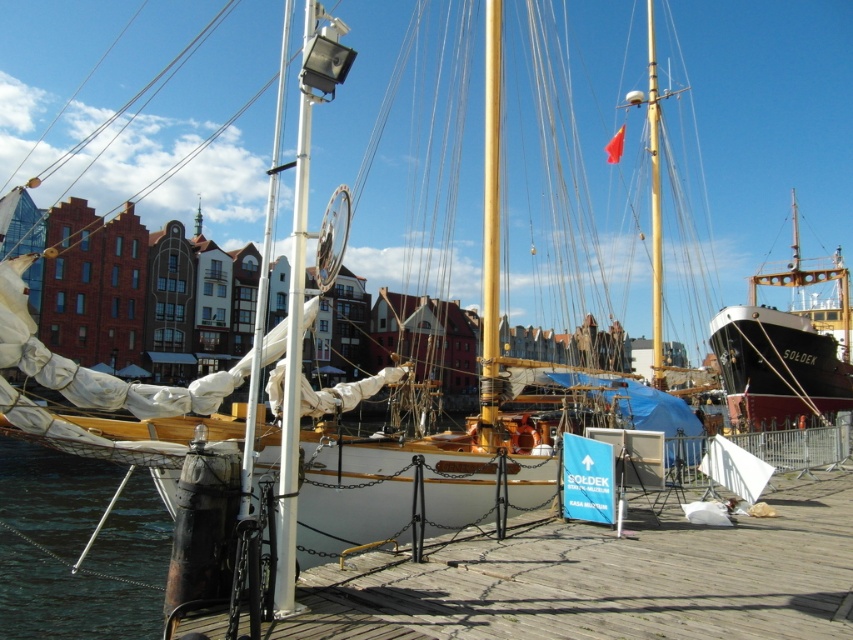
You are a harbor guide and need to direct a visitor to the SOLDEK boat. The visitor is currently standing near the black polished wood ship at right and wants to know how to reach the SOLDEK boat. Which direction should they go relative to the yellow polished wood mast at center?

The black polished wood ship at right is smaller than the yellow polished wood mast at center, so the visitor should head towards the yellow polished wood mast at center to find the SOLDEK boat.

You are a sailor planning to board the black polished wood ship at right from the yellow polished wood mast at center. Considering their heights, will you need to climb down or climb up to reach the ship?

The black polished wood ship at right has a lesser height compared to the yellow polished wood mast at center, so you will need to climb down to reach the ship.